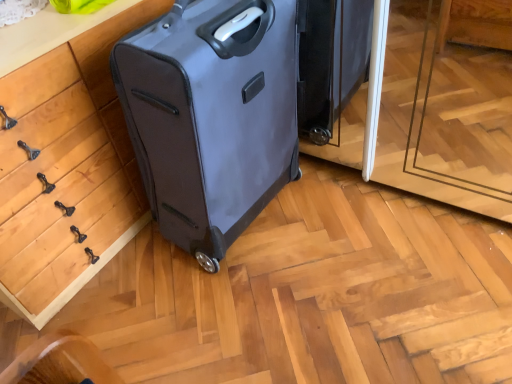
Find the location of a particular element. The image size is (512, 384). vacant area that lies to the right of matte black suitcase at center is located at coordinates pyautogui.click(x=344, y=216).